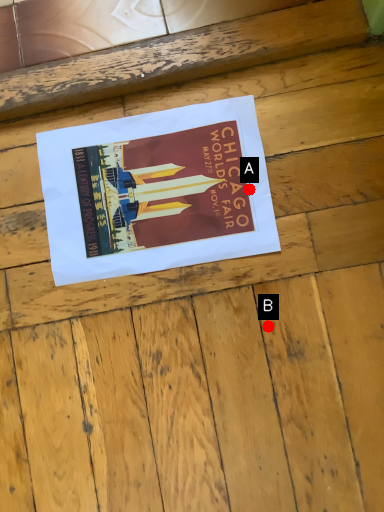
Question: Two points are circled on the image, labeled by A and B beside each circle. Which of the following is the farthest from the observer?

Choices:
 (A) A is further
 (B) B is further

Answer: (A)